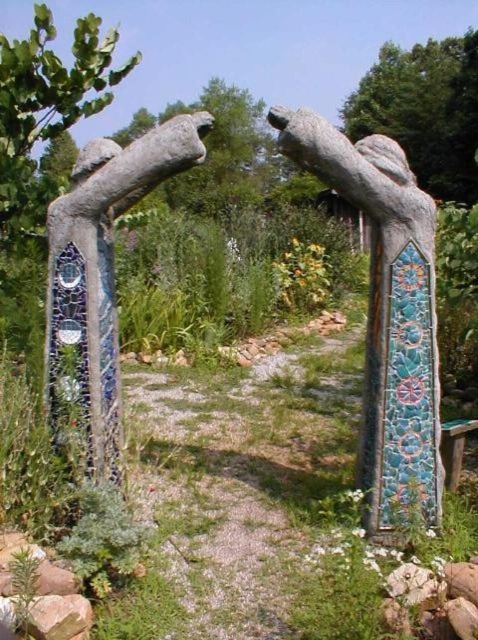
Question: In this image, where is mosaic stone statue at center located relative to mosaic tile arch at center?

Choices:
 (A) above
 (B) below

Answer: (B)

Question: Which point is closer to the camera?

Choices:
 (A) mosaic tile arch at center
 (B) mosaic stone statue at center

Answer: (B)

Question: Which object appears closest to the camera in this image?

Choices:
 (A) mosaic stone statue at center
 (B) mosaic tile arch at center

Answer: (A)

Question: Is mosaic stone statue at center in front of mosaic tile arch at center?

Choices:
 (A) yes
 (B) no

Answer: (A)

Question: Does mosaic stone statue at center appear on the left side of mosaic tile arch at center?

Choices:
 (A) no
 (B) yes

Answer: (A)